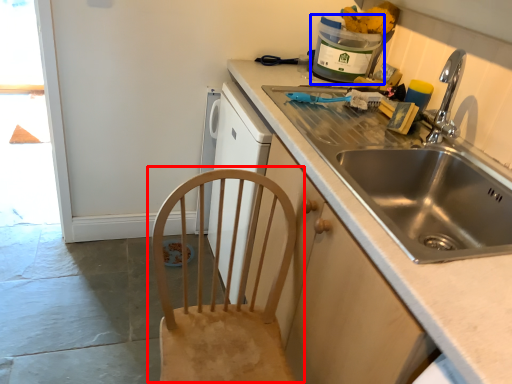
Question: Among these objects, which one is nearest to the camera, chair (highlighted by a red box) or appliance (highlighted by a blue box)?

Choices:
 (A) chair
 (B) appliance

Answer: (A)